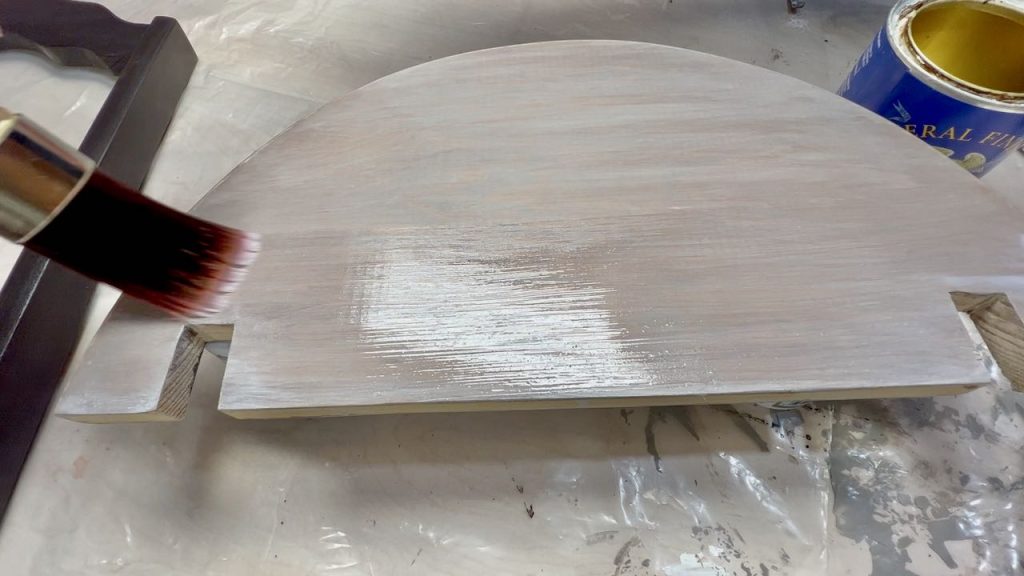
Locate an element on the screen. wooden back of dining room chair is located at coordinates (128, 101).